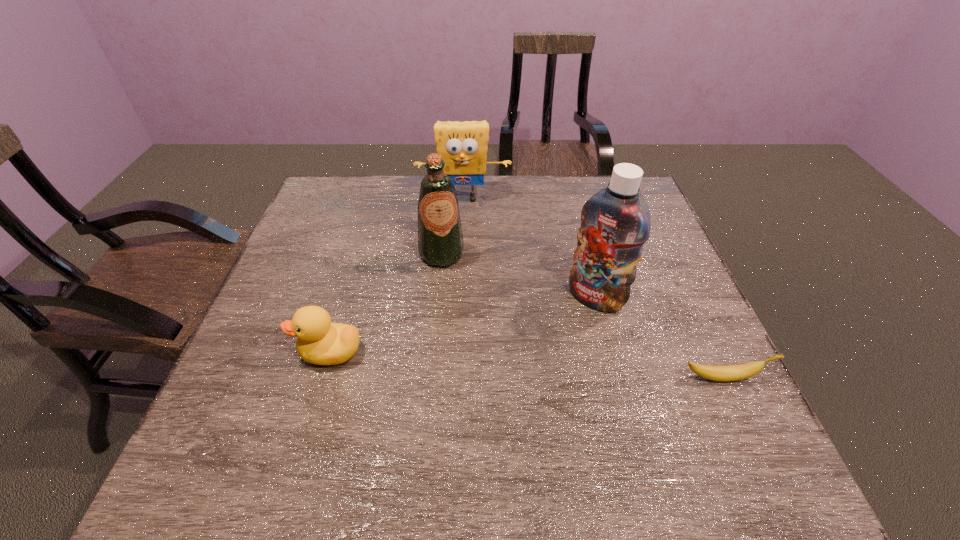
Locate an element on the screen. The image size is (960, 540). vacant point located 0.180m on the front label of the third farthest object is located at coordinates (543, 360).

What are the coordinates of `free space located 0.340m on the front label of the third farthest object` in the screenshot? It's located at (500, 414).

At what (x,y) coordinates should I click in order to perform the action: click on vacant point located 0.070m on the front label of the third farthest object. Please return your answer as a coordinate pair (x, y). This screenshot has height=540, width=960. Looking at the image, I should click on (568, 328).

What are the coordinates of `vacant space situated 0.070m on the face of the third shortest object` in the screenshot? It's located at (465, 223).

Find the location of a particular element. The height and width of the screenshot is (540, 960). free space located 0.240m on the face of the third shortest object is located at coordinates (465, 262).

What are the coordinates of `vacant space located 0.210m on the face of the third shortest object` in the screenshot? It's located at (465, 254).

The width and height of the screenshot is (960, 540). Identify the location of vacant space positioned 0.110m on the front-facing side of the olive oil. (456, 299).

Where is `free space located on the front-facing side of the olive oil`? This screenshot has width=960, height=540. free space located on the front-facing side of the olive oil is located at coordinates (480, 376).

Locate an element on the screen. blank space located on the front-facing side of the olive oil is located at coordinates (480, 376).

The image size is (960, 540). Identify the location of object positioned at the far edge. (462, 145).